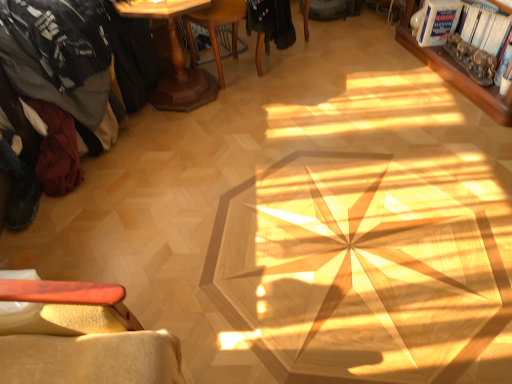
Question: Looking at their shapes, would you say wooden pedestal table at upper left is wider or thinner than metallic silver magazine at upper right, which appears as the first magazine when ordered from the bottom?

Choices:
 (A) thin
 (B) wide

Answer: (B)

Question: Is wooden pedestal table at upper left bigger or smaller than metallic silver magazine at upper right, which appears as the first magazine when ordered from the bottom?

Choices:
 (A) big
 (B) small

Answer: (A)

Question: Estimate the real-world distances between objects in this image. Which object is farther from the metallic silver magazine at upper right, the second magazine viewed from the top?

Choices:
 (A) wooden at center, the second chair when ordered from right to left
 (B) wooden bookshelf at upper right
 (C) wooden pedestal table at upper left
 (D) black fabric chair at center, positioned as the 2th chair in left-to-right order
 (E) dark gray fabric at left

Answer: (E)

Question: Estimate the real-world distances between objects in this image. Which object is closer to the black fabric chair at center, arranged as the first chair when viewed from the right?

Choices:
 (A) wooden pedestal table at upper left
 (B) dark gray fabric at left
 (C) metallic silver magazine at upper right, which appears as the first magazine when ordered from the bottom
 (D) white glossy magazine at upper right, which is the 2th magazine from bottom to top
 (E) wooden at center, the 1th chair in the left-to-right sequence

Answer: (E)